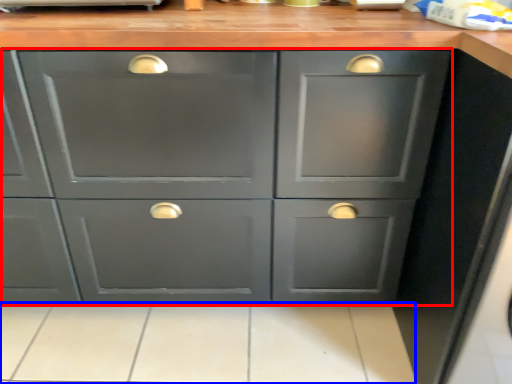
Question: Which point is closer to the camera, cabinetry (highlighted by a red box) or tile (highlighted by a blue box)?

Choices:
 (A) cabinetry
 (B) tile

Answer: (A)